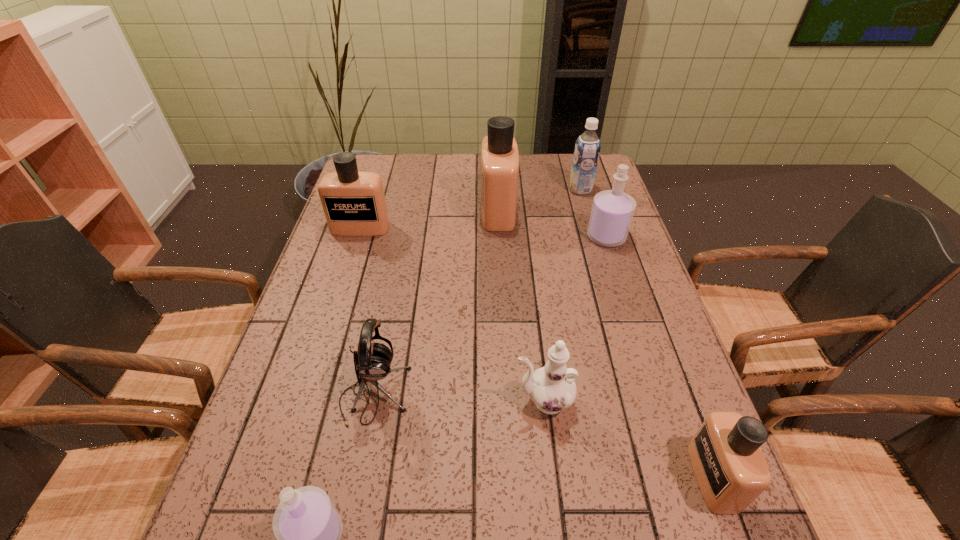
In order to click on free spot between the second biggest beige perfume and the earphone in this screenshot , I will do `click(368, 312)`.

This screenshot has height=540, width=960. In order to click on empty space between the chinaware and the soya milk in this screenshot , I will do `click(562, 295)`.

Where is `object that is the fifth closest one to the soya milk`? This screenshot has width=960, height=540. object that is the fifth closest one to the soya milk is located at coordinates (372, 361).

In order to click on object that is the seventh closest one to the leftmost beige perfume in this screenshot , I will do [730, 468].

Identify the location of perfume that is the third nearest to the nearest beige perfume. (499, 152).

Identify which perfume is the closest to the soya milk. Please provide its 2D coordinates. Your answer should be formatted as a tuple, i.e. [(x, y)], where the tuple contains the x and y coordinates of a point satisfying the conditions above.

[(612, 211)]

Locate an element on the screen. This screenshot has width=960, height=540. beige perfume that can be found as the closest to the bigger purple perfume is located at coordinates (499, 152).

Identify which beige perfume is the closest to the chinaware. Please provide its 2D coordinates. Your answer should be formatted as a tuple, i.e. [(x, y)], where the tuple contains the x and y coordinates of a point satisfying the conditions above.

[(730, 468)]

You are a GUI agent. You are given a task and a screenshot of the screen. Output one action in this format:
    pyautogui.click(x=<x>, y=<y>)
    Task: Click on the vacant region that satisfies the following two spatial constraints: 1. on the front label of the farther purple perfume; 2. on the left side of the tallest perfume
    This screenshot has height=540, width=960.
    Given the screenshot: What is the action you would take?
    pyautogui.click(x=499, y=237)

Image resolution: width=960 pixels, height=540 pixels. I want to click on vacant space that satisfies the following two spatial constraints: 1. on the front label of the leftmost beige perfume; 2. on the right side of the earphone, so click(x=307, y=395).